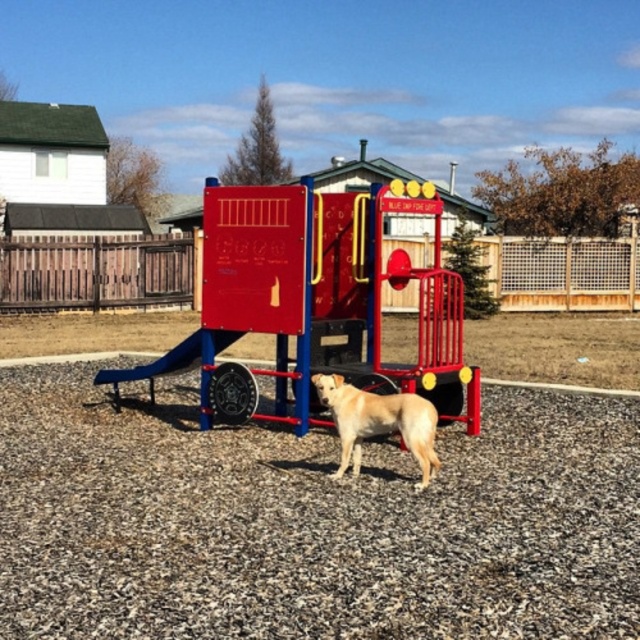
Is metallic red playground equipment at center further to camera compared to golden fur dog at center?

Yes, metallic red playground equipment at center is further from the viewer.

This screenshot has height=640, width=640. Identify the location of metallic red playground equipment at center. (314, 301).

The width and height of the screenshot is (640, 640). What do you see at coordinates (314, 301) in the screenshot?
I see `metallic red playground equipment at center` at bounding box center [314, 301].

At what (x,y) coordinates should I click in order to perform the action: click on metallic red playground equipment at center. Please return your answer as a coordinate pair (x, y). This screenshot has height=640, width=640. Looking at the image, I should click on (314, 301).

Who is higher up, golden fur dog at center or metallic blue slide at center?

Positioned higher is metallic blue slide at center.

Does golden fur dog at center lie in front of metallic blue slide at center?

Yes, it is.

Where is `golden fur dog at center`? The width and height of the screenshot is (640, 640). golden fur dog at center is located at coordinates (378, 422).

Which is behind, point (292, 320) or point (218, 344)?

Positioned behind is point (218, 344).

Does metallic red playground equipment at center have a lesser height compared to metallic blue slide at center?

Indeed, metallic red playground equipment at center has a lesser height compared to metallic blue slide at center.

The width and height of the screenshot is (640, 640). I want to click on metallic red playground equipment at center, so click(314, 301).

Locate an element on the screen. The width and height of the screenshot is (640, 640). metallic red playground equipment at center is located at coordinates [314, 301].